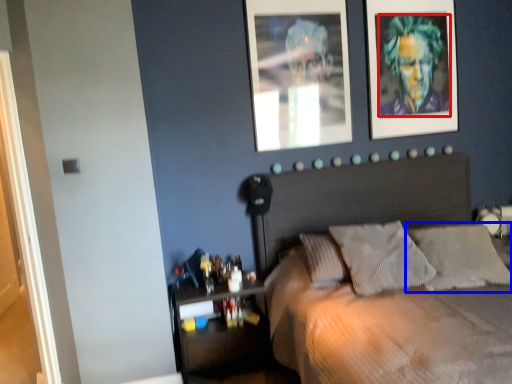
Question: Which object is further to the camera taking this photo, person (highlighted by a red box) or pillow (highlighted by a blue box)?

Choices:
 (A) person
 (B) pillow

Answer: (A)